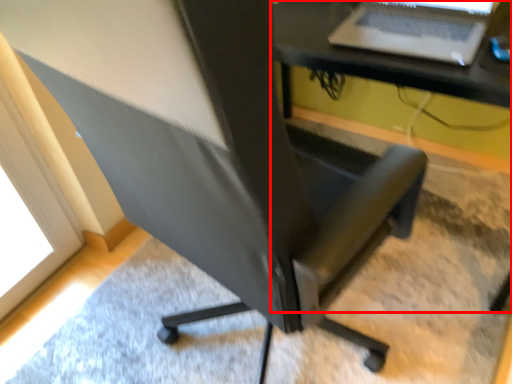
Question: In this image, where is computer desk (annotated by the red box) located relative to laptop?

Choices:
 (A) left
 (B) right

Answer: (B)